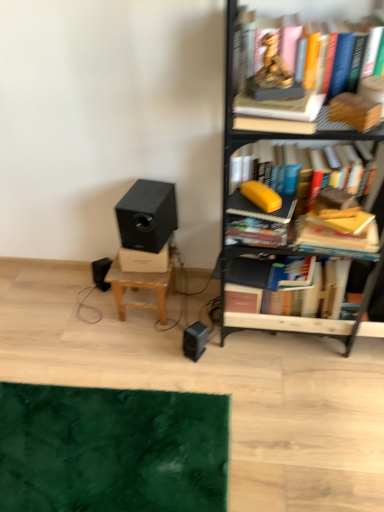
You are a GUI agent. You are given a task and a screenshot of the screen. Output one action in this format:
    pyautogui.click(x=<x>, y=<y>)
    Task: Click on the vacant space to the left of black plastic speaker at lower center
    Image resolution: width=384 pixels, height=512 pixels.
    Given the screenshot: What is the action you would take?
    pyautogui.click(x=159, y=354)